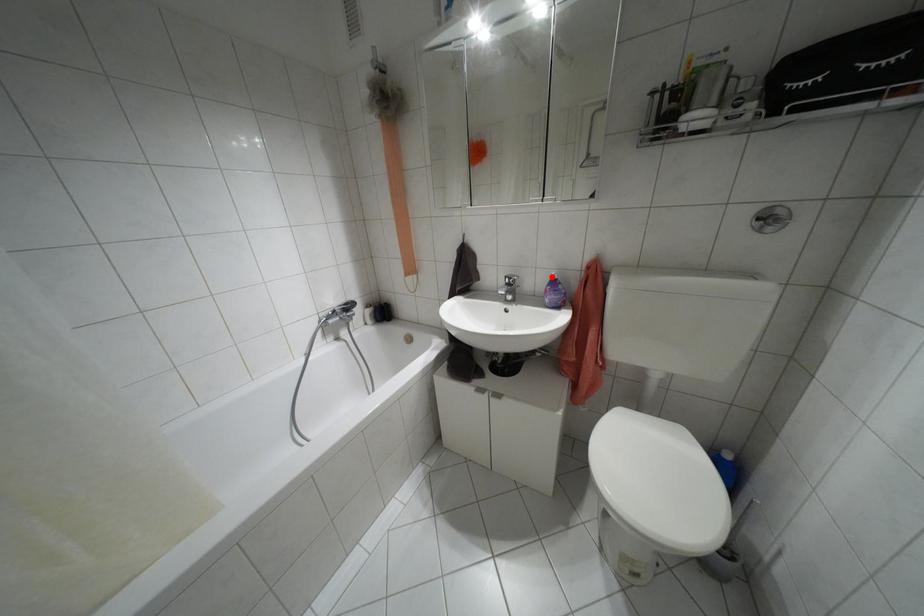
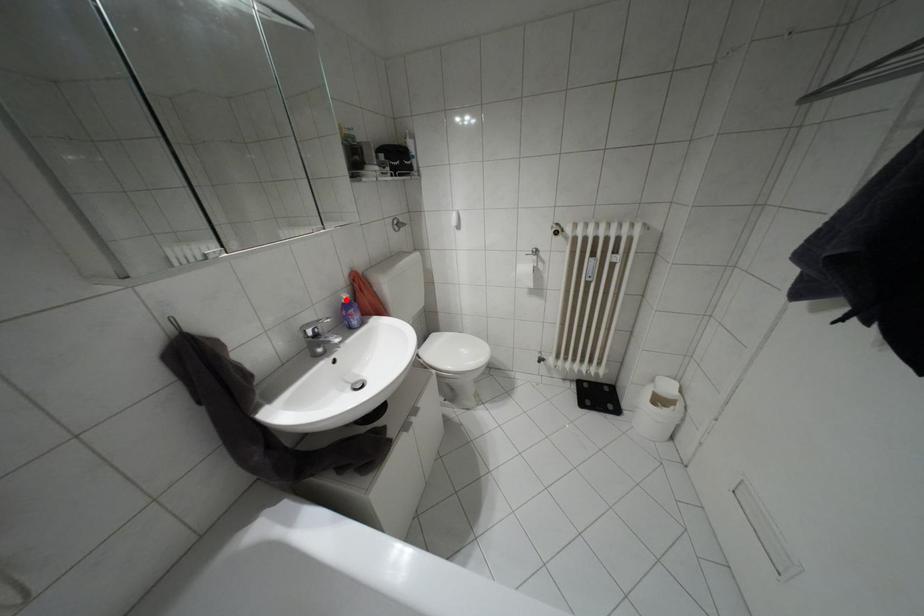
Looking at this image, I am providing you with two images of the same scene from different viewpoints. A red point is marked on the first image and another point is marked on the second image. Are the points marked in image1 and image2 representing the same 3D position?

Yes